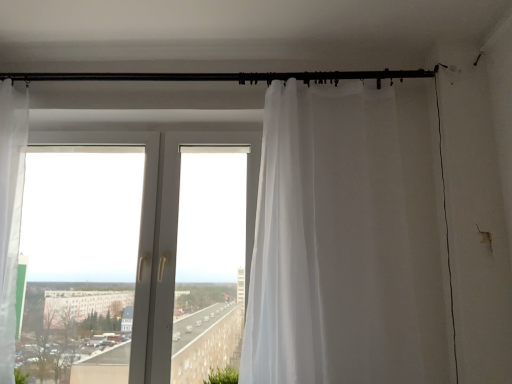
Question: From a real-world perspective, is green leafy plant at lower left below black metal rod at upper center?

Choices:
 (A) no
 (B) yes

Answer: (B)

Question: Is the surface of green leafy plant at lower left in direct contact with black metal rod at upper center?

Choices:
 (A) yes
 (B) no

Answer: (B)

Question: Is green leafy plant at lower left positioned in front of black metal rod at upper center?

Choices:
 (A) yes
 (B) no

Answer: (A)

Question: Can you confirm if green leafy plant at lower left is positioned to the right of black metal rod at upper center?

Choices:
 (A) yes
 (B) no

Answer: (B)

Question: Is green leafy plant at lower left shorter than black metal rod at upper center?

Choices:
 (A) yes
 (B) no

Answer: (B)

Question: From a real-world perspective, does green leafy plant at lower left stand above black metal rod at upper center?

Choices:
 (A) no
 (B) yes

Answer: (A)

Question: Does transparent plastic window at center have a greater height compared to sheer white curtain at right?

Choices:
 (A) no
 (B) yes

Answer: (A)

Question: Does transparent plastic window at center have a larger size compared to sheer white curtain at right?

Choices:
 (A) no
 (B) yes

Answer: (A)

Question: Does transparent plastic window at center have a lesser width compared to sheer white curtain at right?

Choices:
 (A) yes
 (B) no

Answer: (A)

Question: Is transparent plastic window at center to the right of sheer white curtain at right from the viewer's perspective?

Choices:
 (A) yes
 (B) no

Answer: (B)

Question: Considering the relative sizes of transparent plastic window at center and sheer white curtain at right in the image provided, is transparent plastic window at center shorter than sheer white curtain at right?

Choices:
 (A) yes
 (B) no

Answer: (A)

Question: Considering the relative sizes of transparent plastic window at center and sheer white curtain at right in the image provided, is transparent plastic window at center smaller than sheer white curtain at right?

Choices:
 (A) yes
 (B) no

Answer: (A)

Question: From a real-world perspective, does sheer white curtain at right stand above black metal rod at upper center?

Choices:
 (A) no
 (B) yes

Answer: (A)